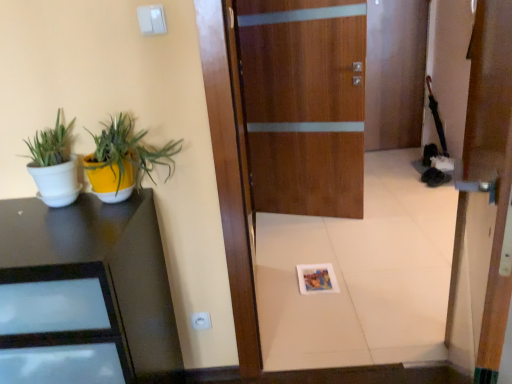
Where is `white plastic electric outlet at lower center`? white plastic electric outlet at lower center is located at coordinates (201, 320).

Measure the distance between white matte pot at left, which is the second houseplant in right-to-left order, and camera.

white matte pot at left, which is the second houseplant in right-to-left order, and camera are 4.28 feet apart from each other.

Locate an element on the screen. The height and width of the screenshot is (384, 512). white plastic electric outlet at lower center is located at coordinates (201, 320).

From a real-world perspective, who is located lower, wooden door at center, marked as the first door in a front-to-back arrangement, or wooden door at center, the 1th door in the back-to-front sequence?

wooden door at center, marked as the first door in a front-to-back arrangement.

Is wooden door at center, marked as the first door in a front-to-back arrangement, shorter than wooden door at center, marked as the second door in a front-to-back arrangement?

Yes.

Find the location of a particular element. The height and width of the screenshot is (384, 512). door that is above the wooden door at center, arranged as the second door when viewed from the back (from the image's perspective) is located at coordinates (305, 103).

Is wooden door at center, arranged as the second door when viewed from the back, next to wooden door at center, marked as the second door in a front-to-back arrangement, and touching it?

No, wooden door at center, arranged as the second door when viewed from the back, is not with wooden door at center, marked as the second door in a front-to-back arrangement.

Considering the relative sizes of wooden door at center, marked as the second door in a front-to-back arrangement, and black glossy desk at left in the image provided, is wooden door at center, marked as the second door in a front-to-back arrangement, thinner than black glossy desk at left?

Yes.

Who is smaller, wooden door at center, marked as the second door in a front-to-back arrangement, or black glossy desk at left?

wooden door at center, marked as the second door in a front-to-back arrangement.

Are wooden door at center, marked as the second door in a front-to-back arrangement, and black glossy desk at left located far from each other?

Yes, wooden door at center, marked as the second door in a front-to-back arrangement, is far from black glossy desk at left.

Is black glossy desk at left at the back of wooden door at center, marked as the second door in a front-to-back arrangement?

No.

Looking at this image, from a real-world perspective, is white matte pot at left, which is the second houseplant in right-to-left order, positioned under yellow matte pot at left, the second houseplant from the left, based on gravity?

Yes, from a real-world perspective, white matte pot at left, which is the second houseplant in right-to-left order, is below yellow matte pot at left, the second houseplant from the left.

Is white matte pot at left, the first houseplant from the left, oriented towards yellow matte pot at left, the second houseplant from the left?

No, white matte pot at left, the first houseplant from the left, is not oriented towards yellow matte pot at left, the second houseplant from the left.

Looking at this image, would you say white matte pot at left, which is the second houseplant in right-to-left order, is to the left or to the right of yellow matte pot at left, which appears as the first houseplant when viewed from the right, in the picture?

In the image, white matte pot at left, which is the second houseplant in right-to-left order, appears on the left side of yellow matte pot at left, which appears as the first houseplant when viewed from the right.

The width and height of the screenshot is (512, 384). Find the location of `houseplant above the white matte pot at left, the first houseplant from the left (from a real-world perspective)`. houseplant above the white matte pot at left, the first houseplant from the left (from a real-world perspective) is located at coordinates (124, 159).

Is white matte pot at left, which is the second houseplant in right-to-left order, inside wooden door at center, marked as the second door in a front-to-back arrangement?

No, wooden door at center, marked as the second door in a front-to-back arrangement, does not contain white matte pot at left, which is the second houseplant in right-to-left order.

From a real-world perspective, which object stands above the other?

white matte pot at left, which is the second houseplant in right-to-left order, is physically above.

Visually, is wooden door at center, the 1th door in the back-to-front sequence, positioned to the left or to the right of white matte pot at left, which is the second houseplant in right-to-left order?

wooden door at center, the 1th door in the back-to-front sequence, is positioned on white matte pot at left, which is the second houseplant in right-to-left order,'s right side.

Are wooden door at center, marked as the second door in a front-to-back arrangement, and white matte pot at left, the first houseplant from the left, far apart?

wooden door at center, marked as the second door in a front-to-back arrangement, is positioned a significant distance from white matte pot at left, the first houseplant from the left.

Does wooden door at center, the 1th door in the back-to-front sequence, have a greater width compared to yellow matte pot at left, the second houseplant from the left?

Incorrect, the width of wooden door at center, the 1th door in the back-to-front sequence, does not surpass that of yellow matte pot at left, the second houseplant from the left.

Where is `door that is above the yellow matte pot at left, which appears as the first houseplant when viewed from the right (from the image's perspective)`? The height and width of the screenshot is (384, 512). door that is above the yellow matte pot at left, which appears as the first houseplant when viewed from the right (from the image's perspective) is located at coordinates (305, 103).

Who is more distant, wooden door at center, marked as the second door in a front-to-back arrangement, or yellow matte pot at left, which appears as the first houseplant when viewed from the right?

wooden door at center, marked as the second door in a front-to-back arrangement.

Who is bigger, wooden door at center, the 1th door in the back-to-front sequence, or yellow matte pot at left, which appears as the first houseplant when viewed from the right?

With larger size is wooden door at center, the 1th door in the back-to-front sequence.

Considering the relative positions of black glossy desk at left and white matte pot at left, the first houseplant from the left, in the image provided, is black glossy desk at left to the right of white matte pot at left, the first houseplant from the left, from the viewer's perspective?

In fact, black glossy desk at left is to the left of white matte pot at left, the first houseplant from the left.

Is black glossy desk at left facing away from white matte pot at left, the first houseplant from the left?

No, black glossy desk at left is not facing the opposite direction of white matte pot at left, the first houseplant from the left.

From the image's perspective, which one is positioned higher, black glossy desk at left or white matte pot at left, which is the second houseplant in right-to-left order?

From the image's view, white matte pot at left, which is the second houseplant in right-to-left order, is above.

Is black glossy desk at left inside or outside of white matte pot at left, the first houseplant from the left?

black glossy desk at left is spatially situated outside white matte pot at left, the first houseplant from the left.

Measure the distance from wooden door at center, marked as the second door in a front-to-back arrangement, to wooden door at center, marked as the first door in a front-to-back arrangement.

wooden door at center, marked as the second door in a front-to-back arrangement, is 4.97 feet from wooden door at center, marked as the first door in a front-to-back arrangement.

From a real-world perspective, is wooden door at center, marked as the second door in a front-to-back arrangement, positioned above or below wooden door at center, marked as the first door in a front-to-back arrangement?

In terms of real-world spatial position, wooden door at center, marked as the second door in a front-to-back arrangement, is above wooden door at center, marked as the first door in a front-to-back arrangement.

Does point (353, 82) lie in front of point (482, 240)?

No, it is not.

Is wooden door at center, the 1th door in the back-to-front sequence, situated inside wooden door at center, marked as the first door in a front-to-back arrangement, or outside?

wooden door at center, the 1th door in the back-to-front sequence, lies outside wooden door at center, marked as the first door in a front-to-back arrangement.

Locate an element on the screen. This screenshot has height=384, width=512. door above the wooden door at center, arranged as the second door when viewed from the back (from a real-world perspective) is located at coordinates (305, 103).

Find the location of a particular element. door that is the 2nd object located above the black glossy desk at left (from the image's perspective) is located at coordinates (305, 103).

Estimate the real-world distances between objects in this image. Which object is closer to white plastic electric outlet at lower center, white matte pot at left, the first houseplant from the left, or yellow matte pot at left, the second houseplant from the left?

yellow matte pot at left, the second houseplant from the left, is positioned closer to the anchor white plastic electric outlet at lower center.

From the image, which object appears to be nearer to black glossy desk at left, wooden door at center, arranged as the second door when viewed from the back, or wooden door at center, the 1th door in the back-to-front sequence?

wooden door at center, arranged as the second door when viewed from the back.

When comparing their distances from white matte pot at left, the first houseplant from the left, does wooden door at center, marked as the second door in a front-to-back arrangement, or black glossy desk at left seem closer?

Based on the image, black glossy desk at left appears to be nearer to white matte pot at left, the first houseplant from the left.

Based on their spatial positions, is wooden door at center, the 1th door in the back-to-front sequence, or white plastic electric outlet at lower center further from wooden door at center, arranged as the second door when viewed from the back?

wooden door at center, the 1th door in the back-to-front sequence, lies further to wooden door at center, arranged as the second door when viewed from the back, than the other object.

When comparing their distances from wooden door at center, arranged as the second door when viewed from the back, does white matte pot at left, which is the second houseplant in right-to-left order, or wooden door at center, the 1th door in the back-to-front sequence, seem closer?

white matte pot at left, which is the second houseplant in right-to-left order, lies closer to wooden door at center, arranged as the second door when viewed from the back, than the other object.

Which object lies nearer to the anchor point white plastic electric outlet at lower center, wooden door at center, marked as the first door in a front-to-back arrangement, or black glossy desk at left?

The object closer to white plastic electric outlet at lower center is black glossy desk at left.

When comparing their distances from black glossy desk at left, does white plastic electric outlet at lower center or wooden door at center, marked as the first door in a front-to-back arrangement, seem further?

wooden door at center, marked as the first door in a front-to-back arrangement, lies further to black glossy desk at left than the other object.

Which object lies further to the anchor point white plastic electric outlet at lower center, yellow matte pot at left, the second houseplant from the left, or wooden door at center, the 1th door in the back-to-front sequence?

wooden door at center, the 1th door in the back-to-front sequence, lies further to white plastic electric outlet at lower center than the other object.

Where is `houseplant between white matte pot at left, the first houseplant from the left, and wooden door at center, arranged as the second door when viewed from the back, in the horizontal direction`? The height and width of the screenshot is (384, 512). houseplant between white matte pot at left, the first houseplant from the left, and wooden door at center, arranged as the second door when viewed from the back, in the horizontal direction is located at coordinates (124, 159).

The height and width of the screenshot is (384, 512). What are the coordinates of `electric outlet between white matte pot at left, which is the second houseplant in right-to-left order, and wooden door at center, marked as the first door in a front-to-back arrangement` in the screenshot? It's located at (201, 320).

Locate an element on the screen. The width and height of the screenshot is (512, 384). electric outlet between black glossy desk at left and wooden door at center, marked as the first door in a front-to-back arrangement, in the horizontal direction is located at coordinates (201, 320).

This screenshot has width=512, height=384. In order to click on houseplant between yellow matte pot at left, which appears as the first houseplant when viewed from the right, and black glossy desk at left, in the vertical direction in this screenshot , I will do `click(54, 165)`.